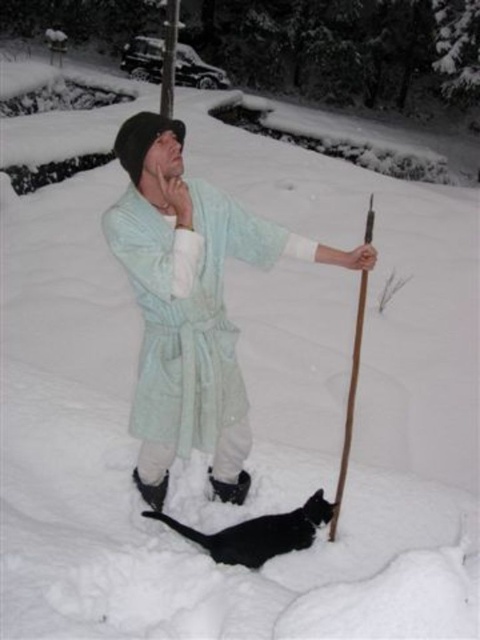
Between black fur cat at lower center and brown wood ski pole at center, which one appears on the left side from the viewer's perspective?

Positioned to the left is black fur cat at lower center.

Does point (311, 531) come in front of point (361, 324)?

Yes, it is in front of point (361, 324).

Is point (192, 538) positioned behind point (358, 344)?

No, (192, 538) is in front of (358, 344).

You are a GUI agent. You are given a task and a screenshot of the screen. Output one action in this format:
    pyautogui.click(x=<x>, y=<y>)
    Task: Click on the black fur cat at lower center
    The height and width of the screenshot is (640, 480).
    Given the screenshot: What is the action you would take?
    pyautogui.click(x=259, y=532)

Can you confirm if light blue fabric robe at center is thinner than black fur cat at lower center?

No.

Is point (193, 296) closer to camera compared to point (278, 536)?

Yes, point (193, 296) is in front of point (278, 536).

Is point (142, 157) less distant than point (303, 538)?

Yes, it is in front of point (303, 538).

The image size is (480, 640). In order to click on light blue fabric robe at center in this screenshot , I will do `click(190, 305)`.

Is light blue fabric robe at center to the left of brown wood ski pole at center from the viewer's perspective?

Indeed, light blue fabric robe at center is positioned on the left side of brown wood ski pole at center.

This screenshot has width=480, height=640. Find the location of `light blue fabric robe at center`. light blue fabric robe at center is located at coordinates (190, 305).